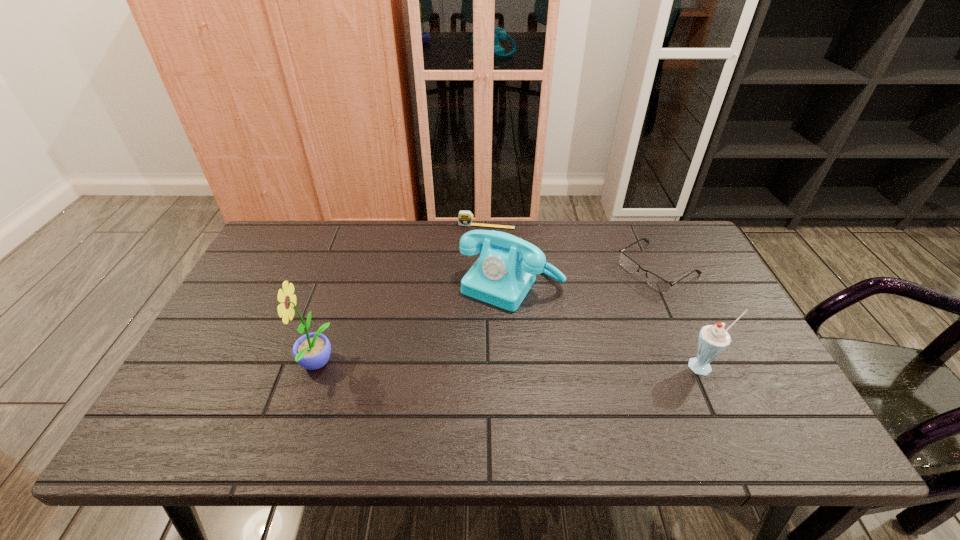
The height and width of the screenshot is (540, 960). Identify the location of the tallest object. (312, 351).

Where is `sunflower`? The height and width of the screenshot is (540, 960). sunflower is located at coordinates (312, 351).

Locate an element on the screen. The image size is (960, 540). milkshake is located at coordinates (713, 339).

You are a GUI agent. You are given a task and a screenshot of the screen. Output one action in this format:
    pyautogui.click(x=<x>, y=<y>)
    Task: Click on the telephone
    The width and height of the screenshot is (960, 540).
    Given the screenshot: What is the action you would take?
    pyautogui.click(x=507, y=267)

At what (x,y) coordinates should I click in order to perform the action: click on spectacles. Please return your answer as a coordinate pair (x, y). The height and width of the screenshot is (540, 960). Looking at the image, I should click on (656, 282).

The height and width of the screenshot is (540, 960). I want to click on the farthest object, so click(465, 218).

The height and width of the screenshot is (540, 960). In order to click on free space located on the front-facing side of the leftmost object in this screenshot , I will do `click(277, 365)`.

In order to click on free region located 0.250m on the front-facing side of the leftmost object in this screenshot , I will do `click(196, 365)`.

You are a GUI agent. You are given a task and a screenshot of the screen. Output one action in this format:
    pyautogui.click(x=<x>, y=<y>)
    Task: Click on the vacant region located on the front-facing side of the leftmost object
    
    Given the screenshot: What is the action you would take?
    pyautogui.click(x=249, y=365)

Identify the location of vacant area situated on the straw side of the milkshake. (718, 396).